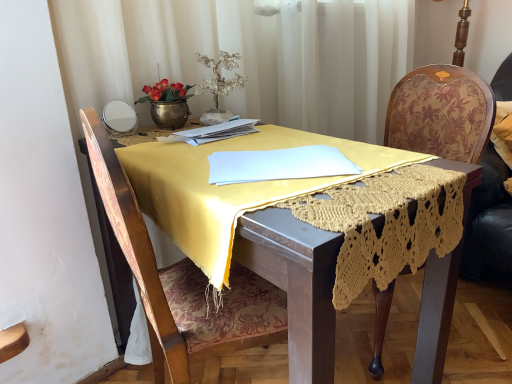
Question: Considering their positions, is yellow fabric table at center located in front of or behind velvet floral swivel chair at right?

Choices:
 (A) behind
 (B) front

Answer: (B)

Question: Considering the positions of yellow fabric table at center and velvet floral swivel chair at right in the image, is yellow fabric table at center taller or shorter than velvet floral swivel chair at right?

Choices:
 (A) short
 (B) tall

Answer: (B)

Question: Which object is positioned farthest from the white paper at center?

Choices:
 (A) velvet floral swivel chair at right
 (B) yellow fabric table at center
 (C) wooden floral-patterned chair at right, marked as the 1th chair in a right-to-left arrangement
 (D) wooden chair at center, which is counted as the first chair, starting from the left

Answer: (A)

Question: Which object is the closest to the wooden floral-patterned chair at right, marked as the 1th chair in a right-to-left arrangement?

Choices:
 (A) wooden chair at center, which ranks as the 2th chair in right-to-left order
 (B) velvet floral swivel chair at right
 (C) white paper at center
 (D) yellow fabric table at center

Answer: (B)